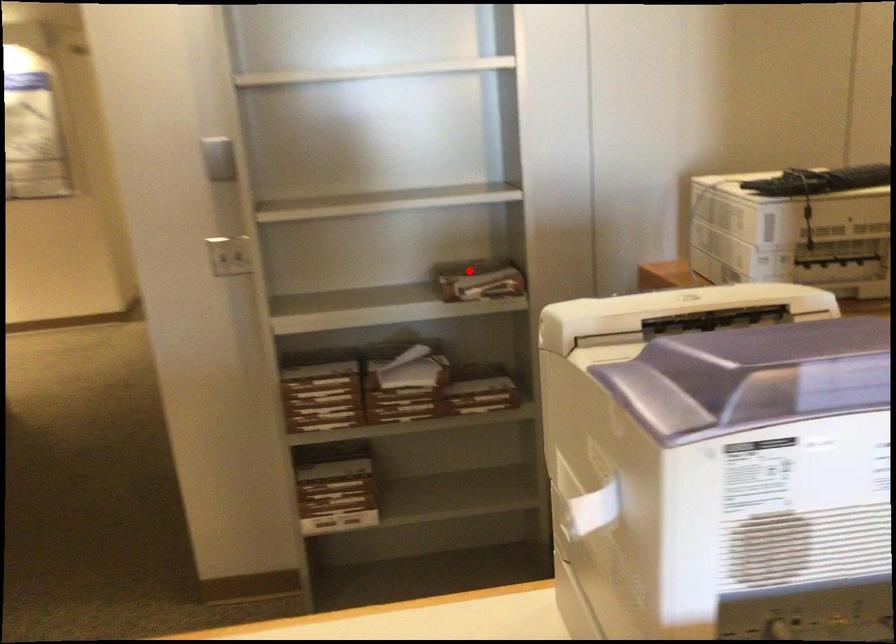
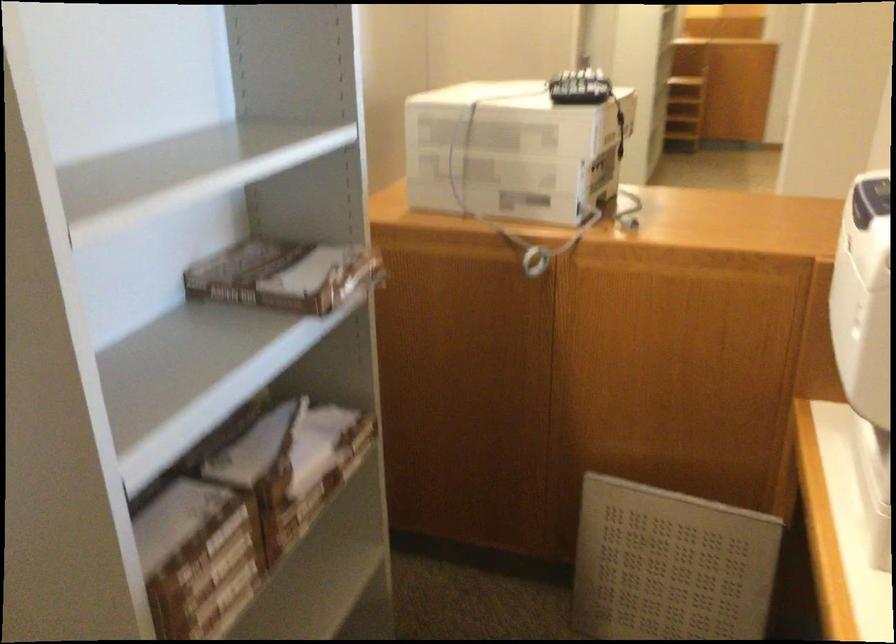
Question: I am providing you with two images of the same scene from different viewpoints. A red point is marked on the first image. Can you still see the location of the red point in image 2?

Choices:
 (A) Yes
 (B) No

Answer: (A)